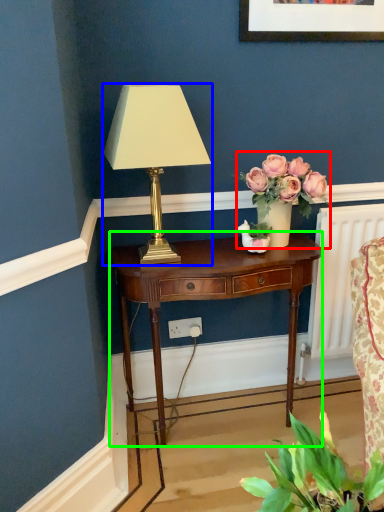
Question: Which is farther away from floral arrangement (highlighted by a red box)? lamp (highlighted by a blue box) or nightstand (highlighted by a green box)?

Choices:
 (A) lamp
 (B) nightstand

Answer: (A)